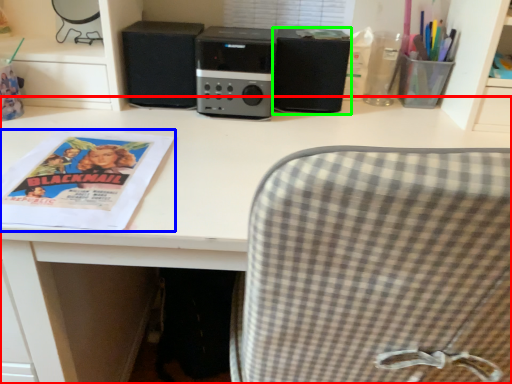
Question: Which is nearer to the desk (highlighted by a red box)? magazine (highlighted by a blue box) or speaker (highlighted by a green box).

Choices:
 (A) magazine
 (B) speaker

Answer: (A)